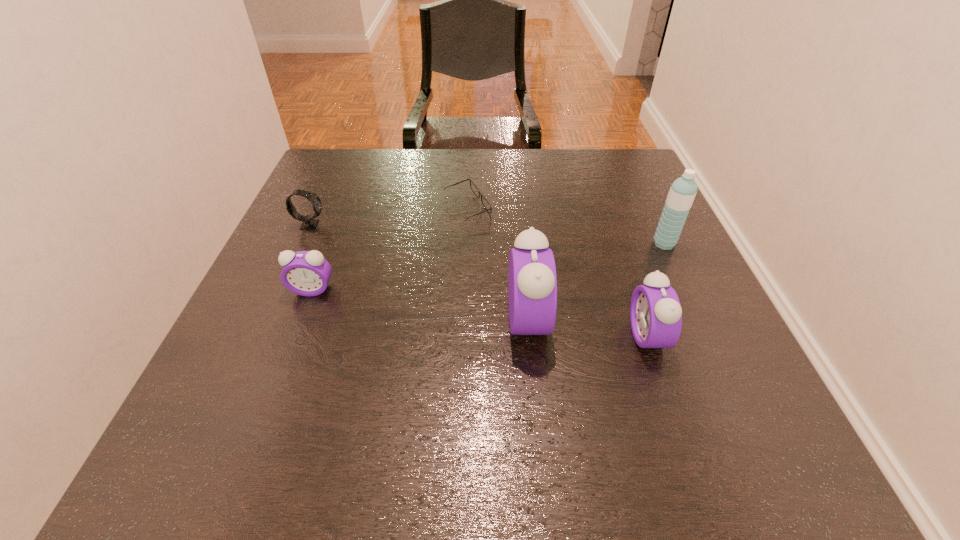
Locate an element on the screen. The image size is (960, 540). spot to insert another alarm_clock for uniform distribution is located at coordinates (417, 304).